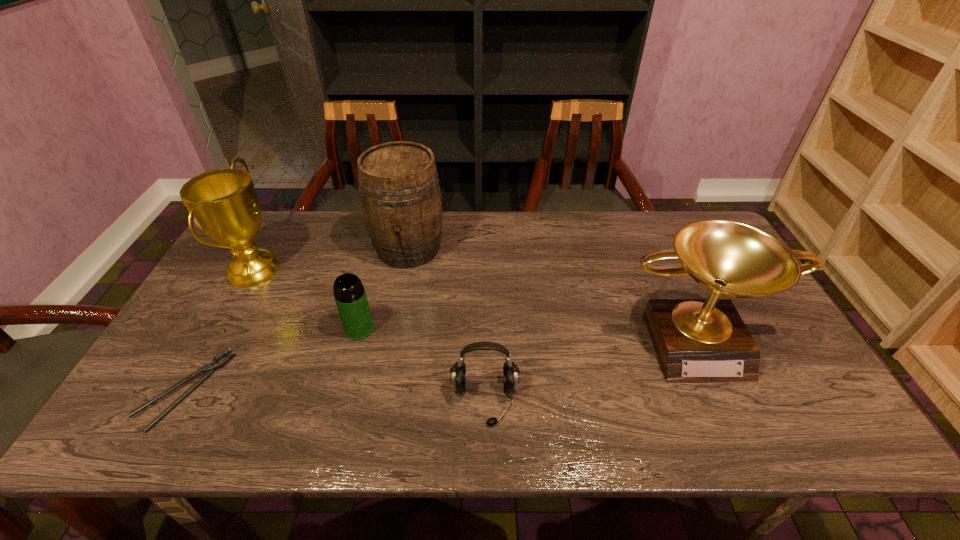
I want to click on free space located from the spout of the thermos bottle, so click(x=339, y=409).

Where is `free space located 0.260m on the back of the shortest object`? free space located 0.260m on the back of the shortest object is located at coordinates (246, 282).

I want to click on cider that is positioned at the far edge, so click(x=399, y=188).

At what (x,y) coordinates should I click in order to perform the action: click on award located at the far edge. Please return your answer as a coordinate pair (x, y). The image size is (960, 540). Looking at the image, I should click on tap(223, 203).

Find the location of a particular element. This screenshot has height=540, width=960. headset situated at the near edge is located at coordinates (511, 371).

Where is `tongs that is at the near edge`? The image size is (960, 540). tongs that is at the near edge is located at coordinates (210, 368).

Identify the location of award present at the left edge. This screenshot has width=960, height=540. (223, 203).

This screenshot has width=960, height=540. Find the location of `tongs at the left edge`. tongs at the left edge is located at coordinates (210, 368).

The height and width of the screenshot is (540, 960). Find the location of `object that is at the right edge`. object that is at the right edge is located at coordinates (696, 340).

Find the location of a particular element. This screenshot has width=960, height=540. object that is at the far left corner is located at coordinates (223, 203).